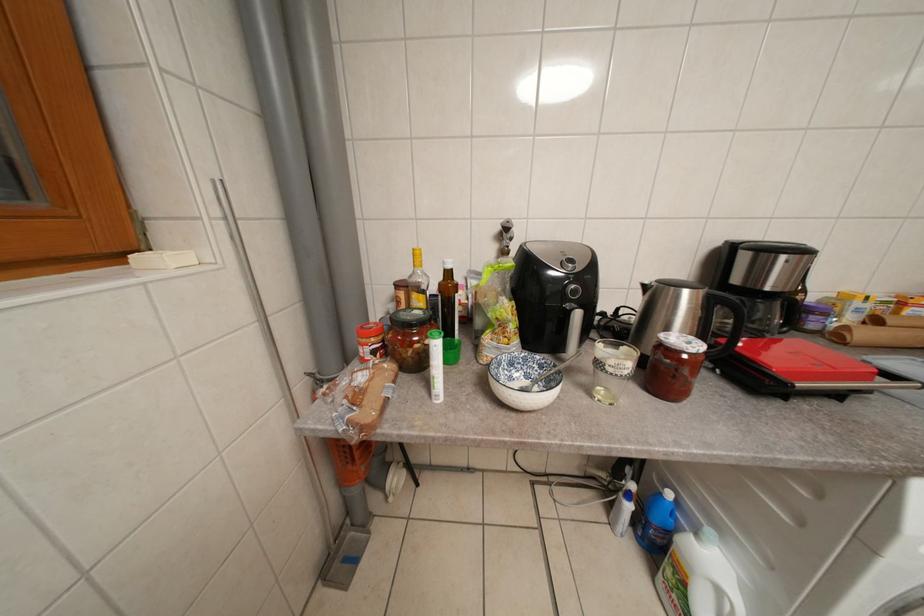
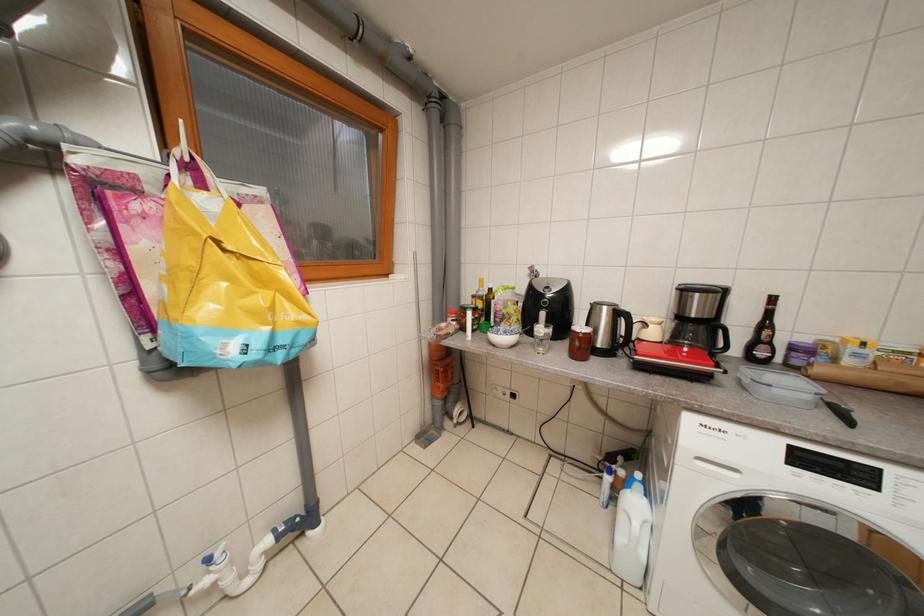
Question: Based on the continuous images, in which direction is the camera rotating? Reply with the corresponding letter.

Choices:
 (A) Left
 (B) Right
 (C) Up
 (D) Down

Answer: (A)